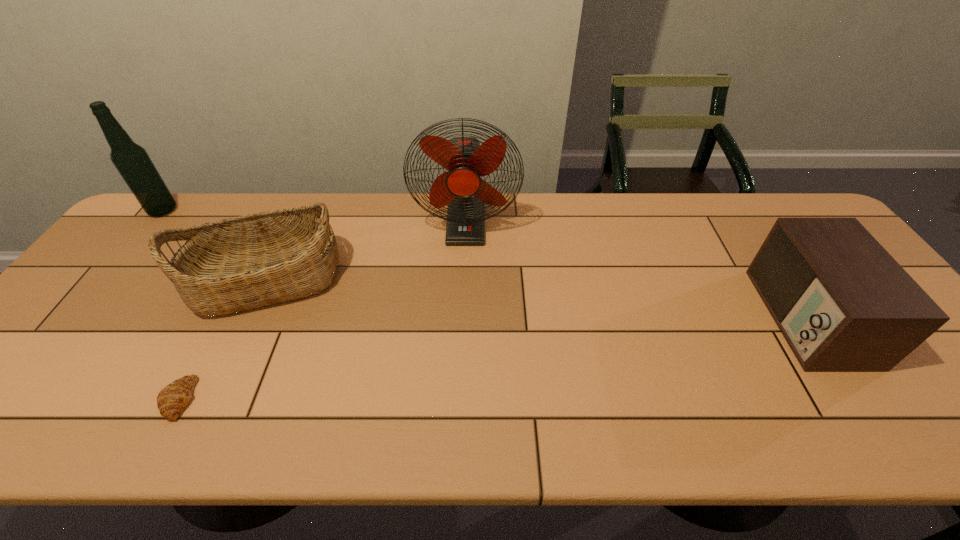
Identify the location of blank region between the basket and the fan. This screenshot has height=540, width=960. (367, 252).

Locate an element on the screen. The width and height of the screenshot is (960, 540). object that is the second closest to the second object from right to left is located at coordinates (171, 400).

Locate which object is the second closest to the radio receiver. Please provide its 2D coordinates. Your answer should be formatted as a tuple, i.e. [(x, y)], where the tuple contains the x and y coordinates of a point satisfying the conditions above.

[(240, 263)]

What are the coordinates of `vacant space that satisfies the following two spatial constraints: 1. on the front side of the basket; 2. on the right side of the alcohol` in the screenshot? It's located at (108, 279).